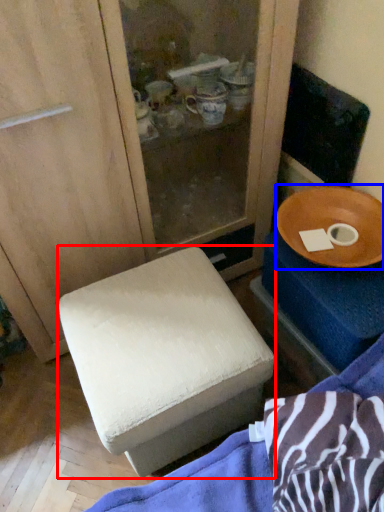
Question: Which of the following is the farthest to the observer, furniture (highlighted by a red box) or tableware (highlighted by a blue box)?

Choices:
 (A) furniture
 (B) tableware

Answer: (B)